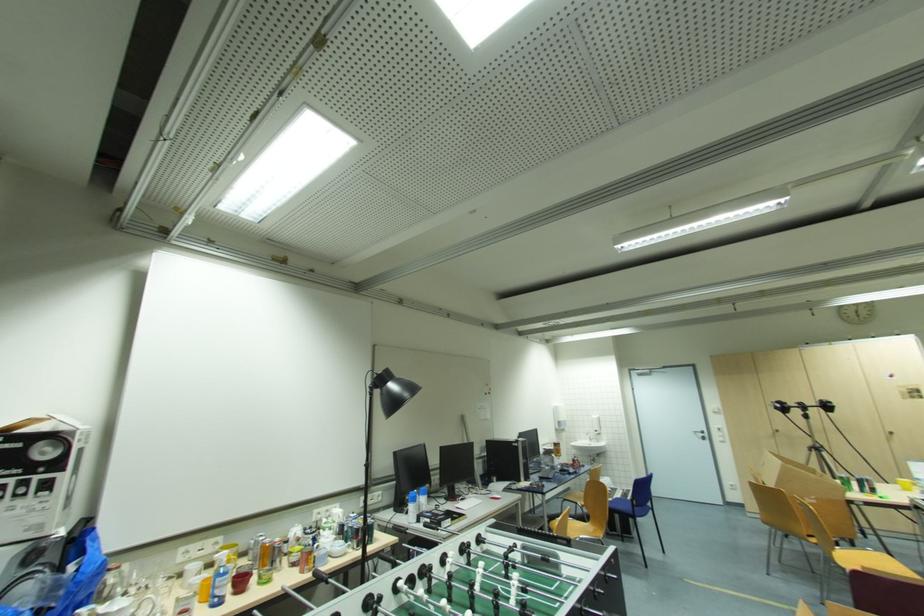
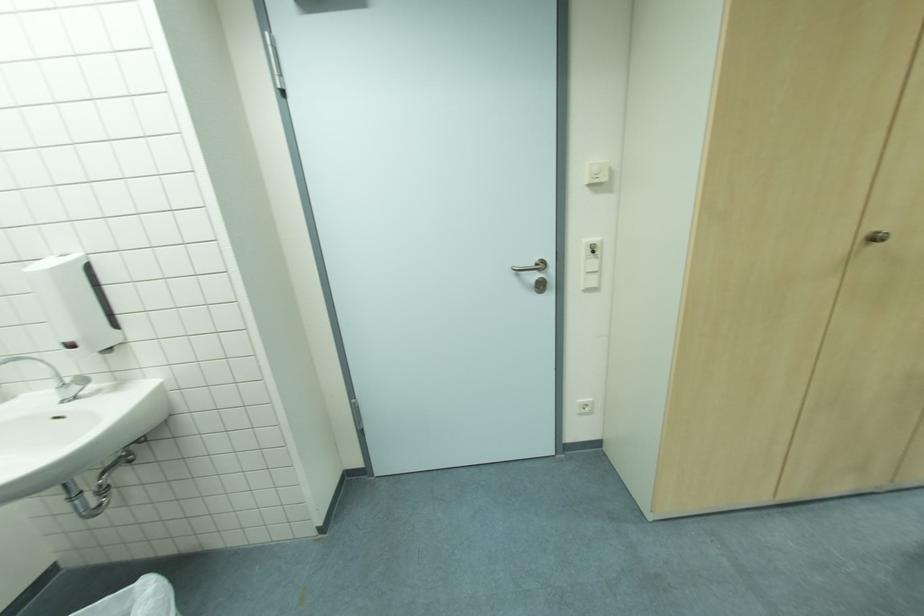
In the second image, find the point that corresponds to point (720, 411) in the first image.

(608, 179)